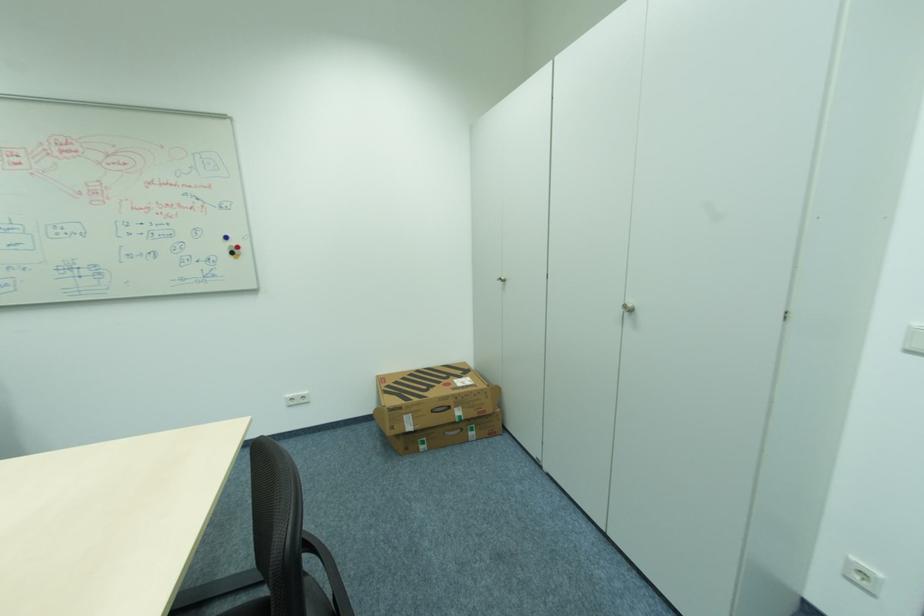
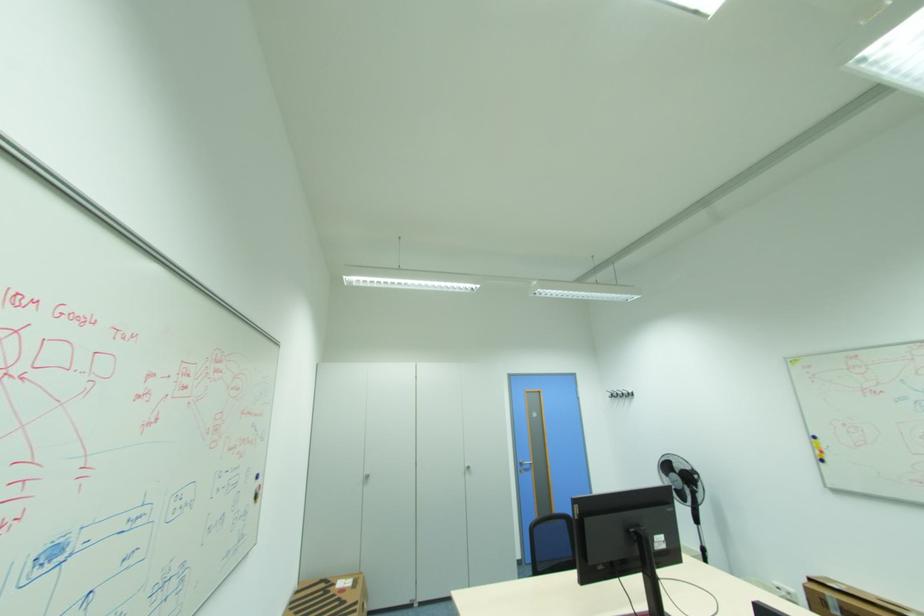
The point at (466, 377) is marked in the first image. Where is the corresponding point in the second image?

(338, 585)